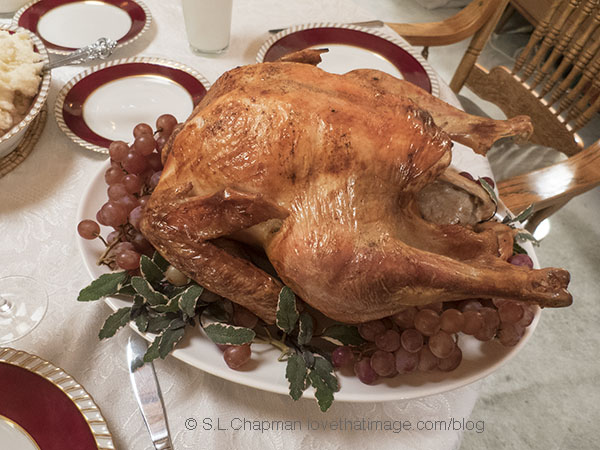
The height and width of the screenshot is (450, 600). Find the location of `table`. table is located at coordinates (548, 398).